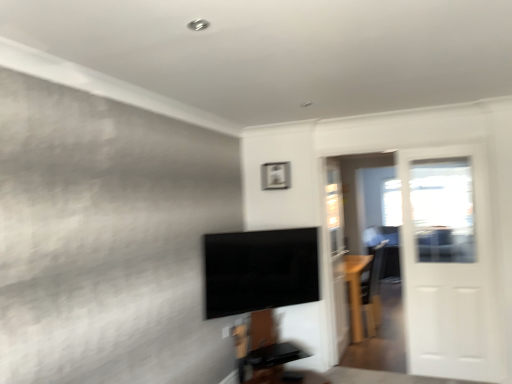
Question: Choose the correct answer: Is black glossy tv at center inside light brown wood table at right or outside it?

Choices:
 (A) outside
 (B) inside

Answer: (A)

Question: Considering their positions, is black glossy tv at center located in front of or behind light brown wood table at right?

Choices:
 (A) front
 (B) behind

Answer: (A)

Question: Which is nearer to the white glossy door at right?

Choices:
 (A) light brown wood table at right
 (B) black glossy tv at center
 (C) matte silver picture frame at upper center

Answer: (A)

Question: Which object is the farthest from the black glossy tv at center?

Choices:
 (A) light brown wood table at right
 (B) matte silver picture frame at upper center
 (C) white glossy door at right

Answer: (C)